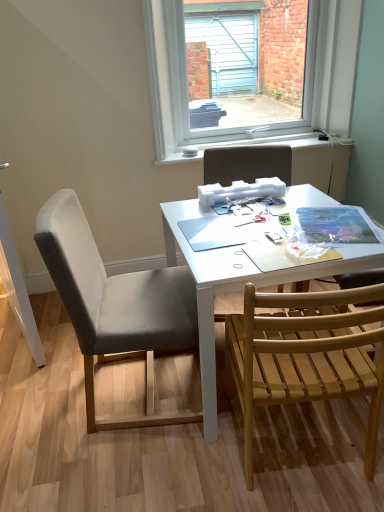
Image resolution: width=384 pixels, height=512 pixels. Describe the element at coordinates (306, 356) in the screenshot. I see `wooden slats chair at lower right, which ranks as the 3th chair in left-to-right order` at that location.

Find the location of `wooden slats chair at lower right, the 1th chair positioned from the right`. wooden slats chair at lower right, the 1th chair positioned from the right is located at coordinates (306, 356).

What do you see at coordinates (115, 305) in the screenshot? I see `gray fabric chair at left, acting as the first chair starting from the left` at bounding box center [115, 305].

This screenshot has height=512, width=384. What are the coordinates of `wooden slats chair at lower right, which ranks as the 3th chair in left-to-right order` in the screenshot? It's located at (306, 356).

Is gray fabric chair at left, the third chair viewed from the right, looking in the opposite direction of clear glass window at upper center?

No, gray fabric chair at left, the third chair viewed from the right, is not facing the opposite direction of clear glass window at upper center.

Is gray fabric chair at left, the third chair viewed from the right, inside or outside of clear glass window at upper center?

gray fabric chair at left, the third chair viewed from the right, is spatially situated outside clear glass window at upper center.

Is gray fabric chair at left, the third chair viewed from the right, bigger or smaller than clear glass window at upper center?

In the image, gray fabric chair at left, the third chair viewed from the right, appears to be larger than clear glass window at upper center.

Could you measure the distance between gray fabric chair at left, the third chair viewed from the right, and clear glass window at upper center?

gray fabric chair at left, the third chair viewed from the right, and clear glass window at upper center are 1.22 meters apart from each other.

Relative to gray fabric chair at left, the third chair viewed from the right, is clear glass window at upper center in front or behind?

clear glass window at upper center is behind gray fabric chair at left, the third chair viewed from the right.

From a real-world perspective, is clear glass window at upper center physically located above or below gray fabric chair at left, acting as the first chair starting from the left?

From a real-world perspective, clear glass window at upper center is physically above gray fabric chair at left, acting as the first chair starting from the left.

Considering the positions of objects clear glass window at upper center and gray fabric chair at left, the third chair viewed from the right, in the image provided, who is more to the right, clear glass window at upper center or gray fabric chair at left, the third chair viewed from the right,?

clear glass window at upper center is more to the right.

Is clear glass window at upper center not within gray fabric chair at left, acting as the first chair starting from the left?

clear glass window at upper center lies outside gray fabric chair at left, acting as the first chair starting from the left,'s area.

Is gray fabric chair at center, positioned as the second chair in left-to-right order, inside or outside of gray fabric chair at left, acting as the first chair starting from the left?

gray fabric chair at center, positioned as the second chair in left-to-right order, is spatially situated outside gray fabric chair at left, acting as the first chair starting from the left.

Considering the relative sizes of gray fabric chair at center, positioned as the second chair in left-to-right order, and gray fabric chair at left, the third chair viewed from the right, in the image provided, is gray fabric chair at center, positioned as the second chair in left-to-right order, wider than gray fabric chair at left, the third chair viewed from the right,?

In fact, gray fabric chair at center, positioned as the second chair in left-to-right order, might be narrower than gray fabric chair at left, the third chair viewed from the right.

Is gray fabric chair at center, acting as the second chair starting from the right, oriented towards gray fabric chair at left, the third chair viewed from the right?

No, gray fabric chair at center, acting as the second chair starting from the right, does not turn towards gray fabric chair at left, the third chair viewed from the right.

Where is `the 1st chair in front of the gray fabric chair at center, positioned as the second chair in left-to-right order`? the 1st chair in front of the gray fabric chair at center, positioned as the second chair in left-to-right order is located at coordinates (115, 305).

Which object is more forward, gray fabric chair at left, acting as the first chair starting from the left, or white matte table at center?

gray fabric chair at left, acting as the first chair starting from the left.

In the scene shown: Considering the sizes of gray fabric chair at left, acting as the first chair starting from the left, and white matte table at center in the image, is gray fabric chair at left, acting as the first chair starting from the left, bigger or smaller than white matte table at center?

gray fabric chair at left, acting as the first chair starting from the left, is smaller than white matte table at center.

Is gray fabric chair at left, acting as the first chair starting from the left, touching white matte table at center?

gray fabric chair at left, acting as the first chair starting from the left, and white matte table at center are clearly separated.

Can you see gray fabric chair at center, acting as the second chair starting from the right, touching white matte table at center?

gray fabric chair at center, acting as the second chair starting from the right, and white matte table at center are not in contact.

Could you measure the distance between gray fabric chair at center, positioned as the second chair in left-to-right order, and white matte table at center?

gray fabric chair at center, positioned as the second chair in left-to-right order, and white matte table at center are 23.41 inches apart.

Which is farther, (249, 157) or (213, 428)?

The point (249, 157) is farther.

Could you tell me if gray fabric chair at center, positioned as the second chair in left-to-right order, is turned towards white matte table at center?

Yes.

From the picture: Can we say white matte table at center lies outside clear glass window at upper center?

Absolutely, white matte table at center is external to clear glass window at upper center.

Between white matte table at center and clear glass window at upper center, which one has larger size?

Bigger between the two is white matte table at center.

Where is `table that is on the left side of clear glass window at upper center`? The height and width of the screenshot is (512, 384). table that is on the left side of clear glass window at upper center is located at coordinates (237, 285).

Is point (294, 275) in front of point (166, 13)?

Yes, it is.

Between gray fabric chair at center, acting as the second chair starting from the right, and clear glass window at upper center, which one has smaller size?

gray fabric chair at center, acting as the second chair starting from the right, is smaller.

From the picture: Considering the relative positions of gray fabric chair at center, acting as the second chair starting from the right, and clear glass window at upper center in the image provided, is gray fabric chair at center, acting as the second chair starting from the right, to the left of clear glass window at upper center from the viewer's perspective?

Yes.

Is gray fabric chair at center, acting as the second chair starting from the right, shorter than clear glass window at upper center?

Yes, gray fabric chair at center, acting as the second chair starting from the right, is shorter than clear glass window at upper center.

Can we say gray fabric chair at center, acting as the second chair starting from the right, lies outside clear glass window at upper center?

Indeed, gray fabric chair at center, acting as the second chair starting from the right, is completely outside clear glass window at upper center.

The image size is (384, 512). Identify the location of window located above the gray fabric chair at left, the third chair viewed from the right (from the image's perspective). (172, 81).

Where is `the 2nd chair in front of the clear glass window at upper center, starting your count from the anchor`? The height and width of the screenshot is (512, 384). the 2nd chair in front of the clear glass window at upper center, starting your count from the anchor is located at coordinates (115, 305).

Based on their spatial positions, is clear glass window at upper center or wooden slats chair at lower right, which ranks as the 3th chair in left-to-right order, closer to gray fabric chair at center, positioned as the second chair in left-to-right order?

clear glass window at upper center is positioned closer to the anchor gray fabric chair at center, positioned as the second chair in left-to-right order.

When comparing their distances from clear glass window at upper center, does gray fabric chair at center, positioned as the second chair in left-to-right order, or gray fabric chair at left, the third chair viewed from the right, seem closer?

gray fabric chair at center, positioned as the second chair in left-to-right order, is positioned closer to the anchor clear glass window at upper center.

Estimate the real-world distances between objects in this image. Which object is closer to white matte table at center, gray fabric chair at center, positioned as the second chair in left-to-right order, or clear glass window at upper center?

gray fabric chair at center, positioned as the second chair in left-to-right order.

Based on their spatial positions, is white matte table at center or gray fabric chair at left, acting as the first chair starting from the left, further from wooden slats chair at lower right, which ranks as the 3th chair in left-to-right order?

gray fabric chair at left, acting as the first chair starting from the left, is further to wooden slats chair at lower right, which ranks as the 3th chair in left-to-right order.

Based on their spatial positions, is clear glass window at upper center or white matte table at center closer to gray fabric chair at center, acting as the second chair starting from the right?

The object closer to gray fabric chair at center, acting as the second chair starting from the right, is clear glass window at upper center.

Considering their positions, is gray fabric chair at center, positioned as the second chair in left-to-right order, positioned further to white matte table at center than wooden slats chair at lower right, which ranks as the 3th chair in left-to-right order?

gray fabric chair at center, positioned as the second chair in left-to-right order.

Which object lies nearer to the anchor point gray fabric chair at left, acting as the first chair starting from the left, wooden slats chair at lower right, which ranks as the 3th chair in left-to-right order, or gray fabric chair at center, positioned as the second chair in left-to-right order?

The object closer to gray fabric chair at left, acting as the first chair starting from the left, is wooden slats chair at lower right, which ranks as the 3th chair in left-to-right order.

Based on their spatial positions, is wooden slats chair at lower right, the 1th chair positioned from the right, or gray fabric chair at left, the third chair viewed from the right, closer to clear glass window at upper center?

Among the two, gray fabric chair at left, the third chair viewed from the right, is located nearer to clear glass window at upper center.

Find the location of a particular element. This screenshot has width=384, height=512. table between clear glass window at upper center and gray fabric chair at left, the third chair viewed from the right, in the vertical direction is located at coordinates (237, 285).

Locate an element on the screen. table that lies between gray fabric chair at center, acting as the second chair starting from the right, and wooden slats chair at lower right, which ranks as the 3th chair in left-to-right order, from top to bottom is located at coordinates (237, 285).

You are a GUI agent. You are given a task and a screenshot of the screen. Output one action in this format:
    pyautogui.click(x=<x>, y=<y>)
    Task: Click on the chair between gray fabric chair at center, acting as the second chair starting from the right, and wooden slats chair at lower right, which ranks as the 3th chair in left-to-right order, in the vertical direction
    This screenshot has height=512, width=384.
    Given the screenshot: What is the action you would take?
    pyautogui.click(x=115, y=305)

Find the location of a particular element. table between gray fabric chair at left, acting as the first chair starting from the left, and wooden slats chair at lower right, the 1th chair positioned from the right, in the horizontal direction is located at coordinates (237, 285).